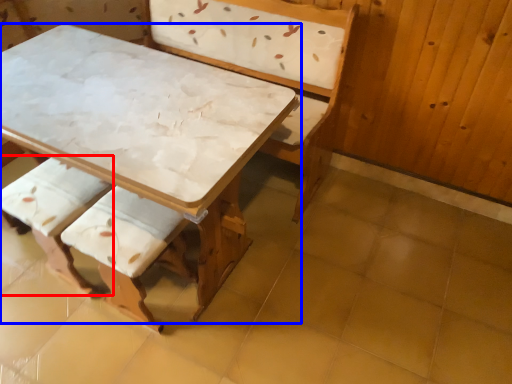
Question: Which object is closer to the camera taking this photo, armchair (highlighted by a red box) or table (highlighted by a blue box)?

Choices:
 (A) armchair
 (B) table

Answer: (B)